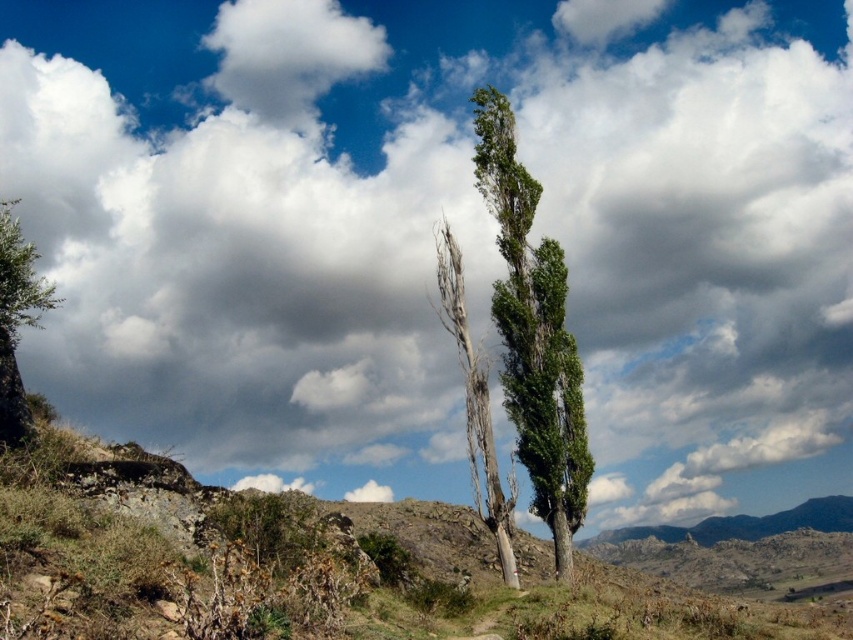
Question: Which object is farther from the camera taking this photo?

Choices:
 (A) green leafy tree at center
 (B) green leafy tree at left

Answer: (A)

Question: Is green leafy tree at center positioned at the back of green leafy tree at left?

Choices:
 (A) no
 (B) yes

Answer: (B)

Question: Which object is farther from the camera taking this photo?

Choices:
 (A) green leafy tree at center
 (B) green leafy tree at left

Answer: (A)

Question: Which of the following is the farthest from the observer?

Choices:
 (A) (15, 317)
 (B) (560, 429)

Answer: (B)

Question: Is green leafy tree at center further to camera compared to green leafy tree at left?

Choices:
 (A) no
 (B) yes

Answer: (B)

Question: Is green leafy tree at center further to the viewer compared to green leafy tree at left?

Choices:
 (A) no
 (B) yes

Answer: (B)